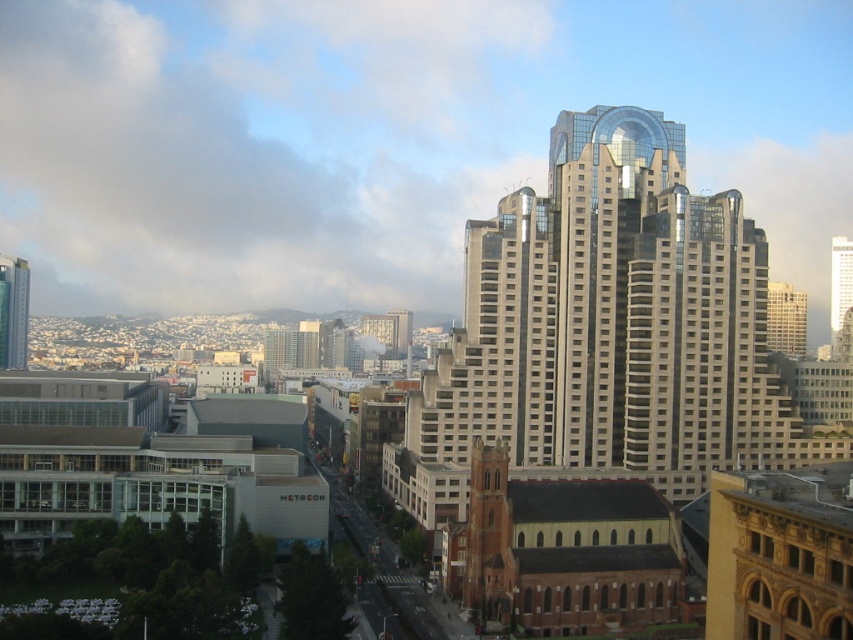
You are standing in the city and want to take a photo of the glassy metallic skyscraper at center. If your camera can capture objects up to 120 meters away, will you be able to take a clear photo of it?

The glassy metallic skyscraper at center is 119.71 meters away from the viewer, which is within the camera range of 120 meters. Therefore, you can take a clear photo of it.

You are a drone operator trying to capture a photo of the city skyline. Your drone is currently at coordinates point 0.5, 0.7. You want to move it to the glassy metallic skyscraper at center. Which direction should you move the drone to reach it?

The glassy metallic skyscraper at center is located at point (605, 332), so you should move the drone slightly to the northeast to reach it.